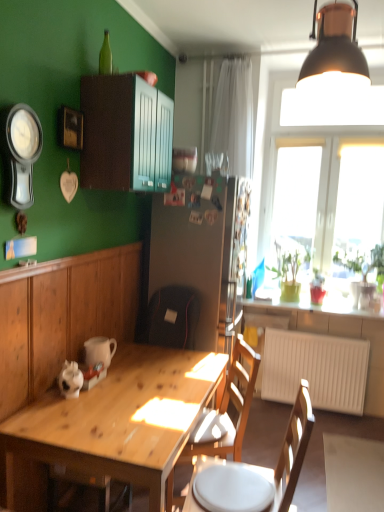
Question: Can you confirm if matte wood cabinet at upper center, which appears as the 2th cabinetry when ordered from the bottom, is positioned to the left of smooth white countertop at window?

Choices:
 (A) no
 (B) yes

Answer: (B)

Question: From a real-world perspective, is matte wood cabinet at upper center, which is counted as the 1th cabinetry, starting from the top, beneath smooth white countertop at window?

Choices:
 (A) no
 (B) yes

Answer: (A)

Question: Considering the relative positions of matte wood cabinet at upper center, which appears as the 2th cabinetry when ordered from the bottom, and smooth white countertop at window in the image provided, is matte wood cabinet at upper center, which appears as the 2th cabinetry when ordered from the bottom, in front of smooth white countertop at window?

Choices:
 (A) no
 (B) yes

Answer: (B)

Question: Is smooth white countertop at window inside matte wood cabinet at upper center, which is counted as the 1th cabinetry, starting from the top?

Choices:
 (A) yes
 (B) no

Answer: (B)

Question: From the image's perspective, is matte wood cabinet at upper center, which is counted as the 1th cabinetry, starting from the top, located beneath smooth white countertop at window?

Choices:
 (A) yes
 (B) no

Answer: (B)

Question: From a real-world perspective, does matte wood cabinet at upper center, which is counted as the 1th cabinetry, starting from the top, stand above smooth white countertop at window?

Choices:
 (A) yes
 (B) no

Answer: (A)

Question: From a real-world perspective, is green glossy plant at window, the second houseplant when ordered from left to right, positioned over wooden desk at lower left based on gravity?

Choices:
 (A) no
 (B) yes

Answer: (B)

Question: Is green glossy plant at window, which appears as the first houseplant when viewed from the front, completely or partially outside of wooden desk at lower left?

Choices:
 (A) yes
 (B) no

Answer: (A)

Question: Could you tell me if green glossy plant at window, the 2th houseplant positioned from the back, is turned towards wooden desk at lower left?

Choices:
 (A) yes
 (B) no

Answer: (B)

Question: Are green glossy plant at window, the second houseplant when ordered from left to right, and wooden desk at lower left far apart?

Choices:
 (A) no
 (B) yes

Answer: (B)

Question: Can you confirm if green glossy plant at window, the 2th houseplant positioned from the back, is positioned to the right of wooden desk at lower left?

Choices:
 (A) no
 (B) yes

Answer: (B)

Question: From the image's perspective, does green glossy plant at window, the 2th houseplant positioned from the back, appear lower than wooden desk at lower left?

Choices:
 (A) yes
 (B) no

Answer: (B)

Question: Are wooden picture frame at upper left and matte wood cabinet at upper center, which is counted as the 1th cabinetry, starting from the top, located far from each other?

Choices:
 (A) no
 (B) yes

Answer: (A)